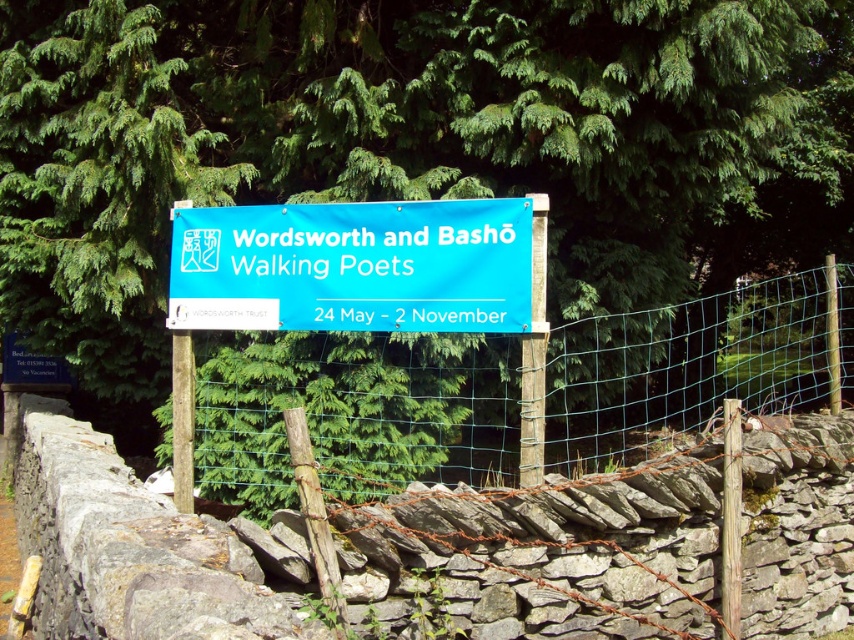
Between point (501, 120) and point (537, 241), which one is positioned in front?

Positioned in front is point (537, 241).

Is green leafy tree at upper center wider than wooden post at center?

Correct, the width of green leafy tree at upper center exceeds that of wooden post at center.

Is point (13, 209) positioned before point (534, 316)?

No.

The height and width of the screenshot is (640, 854). I want to click on green leafy tree at upper center, so click(x=414, y=141).

Looking at this image, does green wire mesh at center appear on the left side of brown wooden post at center?

Incorrect, green wire mesh at center is not on the left side of brown wooden post at center.

Where is `green wire mesh at center`? The image size is (854, 640). green wire mesh at center is located at coordinates (355, 412).

Identify the location of green wire mesh at center. (355, 412).

Who is taller, green leafy tree at upper center or blue fabric banner at center?

With more height is green leafy tree at upper center.

Is green leafy tree at upper center below blue fabric banner at center?

Incorrect, green leafy tree at upper center is not positioned below blue fabric banner at center.

Where is `green leafy tree at upper center`? This screenshot has height=640, width=854. green leafy tree at upper center is located at coordinates 414,141.

I want to click on green leafy tree at upper center, so click(414, 141).